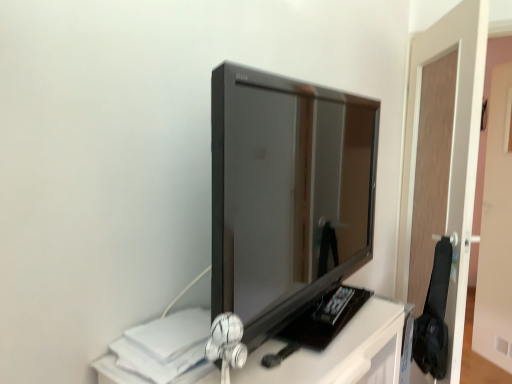
The width and height of the screenshot is (512, 384). In order to click on brown wooden door at right in this screenshot , I will do `click(432, 215)`.

The height and width of the screenshot is (384, 512). What do you see at coordinates (432, 215) in the screenshot? I see `brown wooden door at right` at bounding box center [432, 215].

Describe the element at coordinates (286, 194) in the screenshot. The width and height of the screenshot is (512, 384). I see `glossy black tv at center` at that location.

Image resolution: width=512 pixels, height=384 pixels. I want to click on glossy black tv at center, so click(x=286, y=194).

At what (x,y) coordinates should I click in order to perform the action: click on brown wooden door at right. Please return your answer as a coordinate pair (x, y). This screenshot has height=384, width=512. Looking at the image, I should click on (432, 215).

Is brown wooden door at right to the left of glossy black tv at center from the viewer's perspective?

No.

Is brown wooden door at right in front of or behind glossy black tv at center in the image?

brown wooden door at right is behind glossy black tv at center.

Considering the positions of points (426, 328) and (281, 178), is point (426, 328) farther from camera compared to point (281, 178)?

No, it is not.

From the image's perspective, does brown wooden door at right appear higher than glossy black tv at center?

No, from the image's perspective, brown wooden door at right is not above glossy black tv at center.

From a real-world perspective, is brown wooden door at right on top of glossy black tv at center?

No, from a real-world perspective, brown wooden door at right is not above glossy black tv at center.

Is brown wooden door at right wider or thinner than glossy black tv at center?

Clearly, brown wooden door at right has less width compared to glossy black tv at center.

From their relative heights in the image, would you say brown wooden door at right is taller or shorter than glossy black tv at center?

Clearly, brown wooden door at right is taller compared to glossy black tv at center.

Considering the sizes of brown wooden door at right and glossy black tv at center in the image, is brown wooden door at right bigger or smaller than glossy black tv at center?

brown wooden door at right is bigger than glossy black tv at center.

Looking at this image, choose the correct answer: Is brown wooden door at right inside glossy black tv at center or outside it?

brown wooden door at right is spatially situated outside glossy black tv at center.

Is brown wooden door at right with glossy black tv at center?

brown wooden door at right and glossy black tv at center are not in contact.

Is brown wooden door at right aimed at glossy black tv at center?

Yes.

How much distance is there between brown wooden door at right and glossy black tv at center?

33.07 inches.

This screenshot has width=512, height=384. Identify the location of television above the brown wooden door at right (from a real-world perspective). (286, 194).

Considering the relative positions of glossy black tv at center and brown wooden door at right in the image provided, is glossy black tv at center to the right of brown wooden door at right from the viewer's perspective?

No, glossy black tv at center is not to the right of brown wooden door at right.

Considering the positions of objects glossy black tv at center and brown wooden door at right in the image provided, who is in front, glossy black tv at center or brown wooden door at right?

glossy black tv at center is more forward.

Between point (257, 71) and point (443, 135), which one is positioned in front?

The point (257, 71) is closer.

From the image's perspective, is glossy black tv at center beneath brown wooden door at right?

No, from the image's perspective, glossy black tv at center is not beneath brown wooden door at right.

From a real-world perspective, between glossy black tv at center and brown wooden door at right, who is vertically lower?

brown wooden door at right, from a real-world perspective.

Which object is thinner, glossy black tv at center or brown wooden door at right?

Thinner between the two is brown wooden door at right.

Based on the photo, is glossy black tv at center taller or shorter than brown wooden door at right?

Considering their sizes, glossy black tv at center has less height than brown wooden door at right.

Looking at the image, does glossy black tv at center seem bigger or smaller compared to brown wooden door at right?

In the image, glossy black tv at center appears to be smaller than brown wooden door at right.

Is glossy black tv at center completely or partially outside of brown wooden door at right?

A: glossy black tv at center lies outside brown wooden door at right's area.

Is glossy black tv at center not close to brown wooden door at right?

They are positioned close to each other.

Is glossy black tv at center oriented away from brown wooden door at right?

glossy black tv at center is not turned away from brown wooden door at right.

Consider the image. Can you tell me how much glossy black tv at center and brown wooden door at right differ in facing direction?

There is a 97.2-degree angle between the facing directions of glossy black tv at center and brown wooden door at right.

Find the location of a particular element. glass door behind the glossy black tv at center is located at coordinates (432, 215).

Where is `television lying above the brown wooden door at right (from the image's perspective)`? The height and width of the screenshot is (384, 512). television lying above the brown wooden door at right (from the image's perspective) is located at coordinates (286, 194).

At what (x,y) coordinates should I click in order to perform the action: click on glass door to the right of glossy black tv at center. Please return your answer as a coordinate pair (x, y). Looking at the image, I should click on (432, 215).